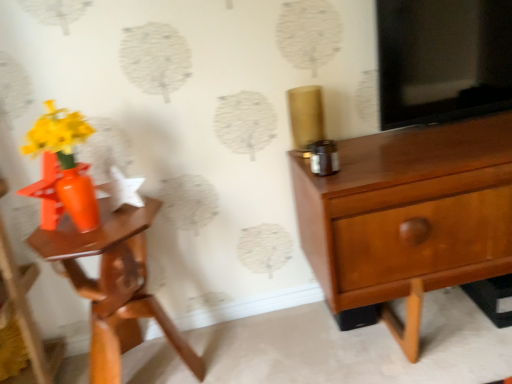
You are a GUI agent. You are given a task and a screenshot of the screen. Output one action in this format:
    pyautogui.click(x=<x>, y=<y>)
    Task: Click on the matte orange nightstand at left
    Image resolution: width=512 pixels, height=384 pixels.
    Given the screenshot: What is the action you would take?
    pyautogui.click(x=114, y=285)

What are the coordinates of `matte orange nightstand at left` in the screenshot? It's located at (114, 285).

From the picture: Is matte orange nightstand at left to the right of orange glossy vase at left from the viewer's perspective?

Indeed, matte orange nightstand at left is positioned on the right side of orange glossy vase at left.

From a real-world perspective, is matte orange nightstand at left located higher than orange glossy vase at left?

No, from a real-world perspective, matte orange nightstand at left is not over orange glossy vase at left

In terms of size, does matte orange nightstand at left appear bigger or smaller than orange glossy vase at left?

Considering their sizes, matte orange nightstand at left takes up more space than orange glossy vase at left.

From the image's perspective, is matte orange nightstand at left located above orange glossy vase at left?

Actually, matte orange nightstand at left appears below orange glossy vase at left in the image.

Which is more to the right, matte wood chest of drawers at right or matte orange nightstand at left?

matte wood chest of drawers at right is more to the right.

Could you tell me if matte wood chest of drawers at right is turned towards matte orange nightstand at left?

No, matte wood chest of drawers at right does not turn towards matte orange nightstand at left.

Which is closer, (318, 256) or (137, 315)?

The point (318, 256) is closer.

Does matte wood chest of drawers at right contain matte orange nightstand at left?

Definitely not — matte orange nightstand at left is not inside matte wood chest of drawers at right.

Which object is thinner, orange glossy vase at left or matte orange nightstand at left?

With smaller width is orange glossy vase at left.

From a real-world perspective, who is located higher, orange glossy vase at left or matte orange nightstand at left?

In real-world perspective, orange glossy vase at left is above.

Is orange glossy vase at left next to matte orange nightstand at left?

orange glossy vase at left and matte orange nightstand at left are not in contact.

Is matte wood chest of drawers at right oriented towards orange glossy vase at left?

No, matte wood chest of drawers at right is not turned towards orange glossy vase at left.

Considering the sizes of matte wood chest of drawers at right and orange glossy vase at left in the image, is matte wood chest of drawers at right taller or shorter than orange glossy vase at left?

Considering their sizes, matte wood chest of drawers at right has more height than orange glossy vase at left.

Does point (462, 267) appear closer or farther from the camera than point (87, 176)?

Point (462, 267).

From the picture: How many degrees apart are the facing directions of matte wood chest of drawers at right and orange glossy vase at left?

55.4 degrees.

Looking at this image, is matte orange nightstand at left far away from matte wood chest of drawers at right?

No.

Consider the image. Can you tell me how much matte orange nightstand at left and matte wood chest of drawers at right differ in facing direction?

matte orange nightstand at left and matte wood chest of drawers at right are facing 1.14 degrees away from each other.

Which of these two, matte orange nightstand at left or matte wood chest of drawers at right, is wider?

Wider between the two is matte wood chest of drawers at right.

Considering the points (123, 291) and (347, 303), which point is in front, point (123, 291) or point (347, 303)?

The point (347, 303) is closer.

Looking at the image, does orange glossy vase at left seem bigger or smaller compared to matte wood chest of drawers at right?

Considering their sizes, orange glossy vase at left takes up less space than matte wood chest of drawers at right.

Is orange glossy vase at left to the right of matte wood chest of drawers at right from the viewer's perspective?

Incorrect, orange glossy vase at left is not on the right side of matte wood chest of drawers at right.

Considering the sizes of orange glossy vase at left and matte wood chest of drawers at right in the image, is orange glossy vase at left wider or thinner than matte wood chest of drawers at right?

Considering their sizes, orange glossy vase at left looks slimmer than matte wood chest of drawers at right.

Which is behind, point (74, 165) or point (442, 227)?

The point (442, 227) is more distant.

This screenshot has width=512, height=384. I want to click on floral arrangement behind the matte orange nightstand at left, so click(x=62, y=170).

Locate an element on the screen. chest of drawers on the right of matte orange nightstand at left is located at coordinates (409, 217).

Estimate the real-world distances between objects in this image. Which object is closer to matte orange nightstand at left, matte wood chest of drawers at right or orange glossy vase at left?

orange glossy vase at left is closer to matte orange nightstand at left.

Looking at the image, which one is located closer to orange glossy vase at left, matte wood chest of drawers at right or matte orange nightstand at left?

matte orange nightstand at left lies closer to orange glossy vase at left than the other object.

Considering their positions, is matte orange nightstand at left positioned closer to orange glossy vase at left than matte wood chest of drawers at right?

Based on the image, matte orange nightstand at left appears to be nearer to orange glossy vase at left.

Considering their positions, is matte orange nightstand at left positioned further to matte wood chest of drawers at right than orange glossy vase at left?

Among the two, orange glossy vase at left is located further to matte wood chest of drawers at right.

Based on their spatial positions, is orange glossy vase at left or matte orange nightstand at left further from matte wood chest of drawers at right?

orange glossy vase at left is further to matte wood chest of drawers at right.

Looking at the image, which one is located further to matte orange nightstand at left, orange glossy vase at left or matte wood chest of drawers at right?

matte wood chest of drawers at right.

Locate an element on the screen. The width and height of the screenshot is (512, 384). nightstand between orange glossy vase at left and matte wood chest of drawers at right from left to right is located at coordinates (114, 285).